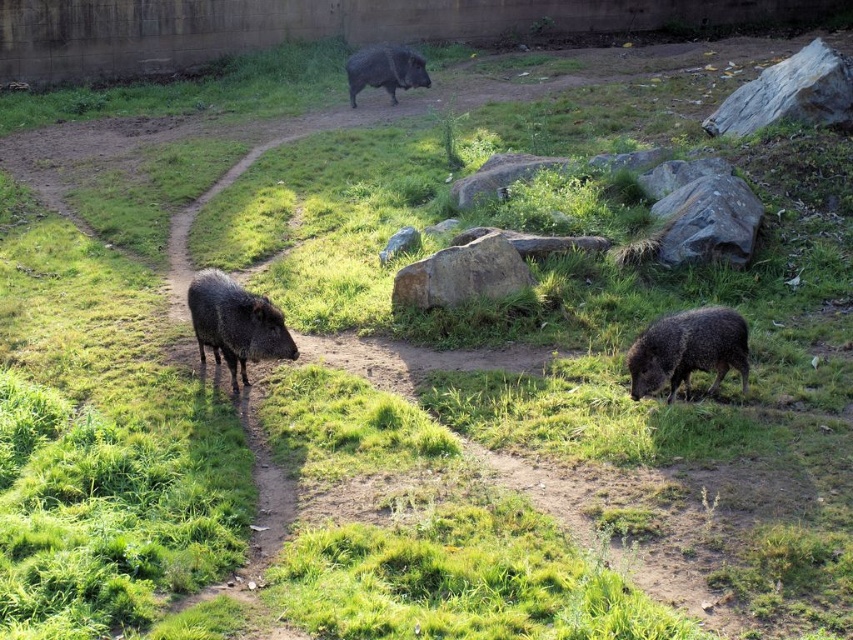
You are a zookeeper observing the peccaries in their enclosure. You notice two points marked on the ground where peccaries have been resting. The points are labeled as point 1 at coordinates (730,364) and point 2 at (351,90). From your vantage point, which point is closer to you?

Point 1 at coordinates (730,364) is closer to you because it is in front of point 2 at (351,90).